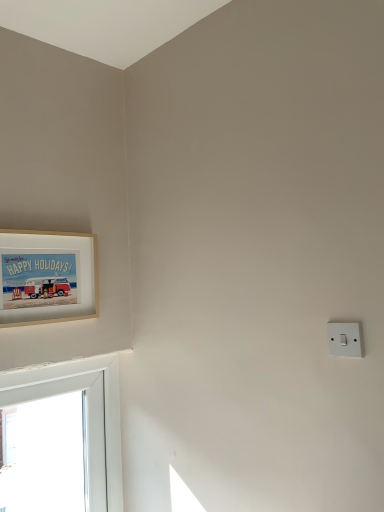
Question: Is wooden frame at upper left at the left side of white plastic light switch at right?

Choices:
 (A) yes
 (B) no

Answer: (A)

Question: Is wooden frame at upper left not within white plastic light switch at right?

Choices:
 (A) no
 (B) yes

Answer: (B)

Question: Considering the relative sizes of wooden frame at upper left and white plastic light switch at right in the image provided, is wooden frame at upper left taller than white plastic light switch at right?

Choices:
 (A) no
 (B) yes

Answer: (B)

Question: Could you tell me if wooden frame at upper left is turned towards white plastic light switch at right?

Choices:
 (A) yes
 (B) no

Answer: (A)

Question: From the image's perspective, is wooden frame at upper left on top of white plastic light switch at right?

Choices:
 (A) yes
 (B) no

Answer: (A)

Question: Does wooden frame at upper left have a greater width compared to white plastic light switch at right?

Choices:
 (A) no
 (B) yes

Answer: (B)

Question: Is white plastic light switch at right shorter than wooden frame at upper left?

Choices:
 (A) yes
 (B) no

Answer: (A)

Question: Is white plastic light switch at right further to the viewer compared to wooden frame at upper left?

Choices:
 (A) yes
 (B) no

Answer: (B)

Question: Considering the relative sizes of white plastic light switch at right and wooden frame at upper left in the image provided, is white plastic light switch at right wider than wooden frame at upper left?

Choices:
 (A) yes
 (B) no

Answer: (B)

Question: Is white plastic light switch at right turned away from wooden frame at upper left?

Choices:
 (A) no
 (B) yes

Answer: (A)

Question: From a real-world perspective, is white plastic light switch at right below wooden frame at upper left?

Choices:
 (A) yes
 (B) no

Answer: (A)

Question: From the image's perspective, is white plastic light switch at right located above wooden frame at upper left?

Choices:
 (A) yes
 (B) no

Answer: (B)

Question: Is point (334, 342) positioned closer to the camera than point (66, 282)?

Choices:
 (A) closer
 (B) farther

Answer: (A)